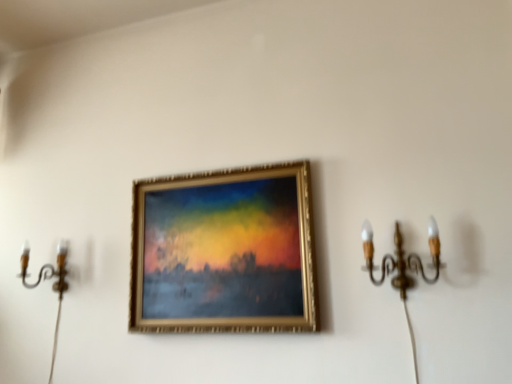
Identify the location of gold metallic chandelier at right, the second candle holder positioned from the back. (401, 258).

The height and width of the screenshot is (384, 512). What do you see at coordinates (47, 269) in the screenshot?
I see `gold metallic candle holder at left, acting as the first candle holder starting from the back` at bounding box center [47, 269].

At what (x,y) coordinates should I click in order to perform the action: click on gold metallic chandelier at right, which is the first candle holder from front to back. Please return your answer as a coordinate pair (x, y). The width and height of the screenshot is (512, 384). Looking at the image, I should click on (401, 258).

Does gold metallic chandelier at right, which appears as the 1th candle holder when viewed from the right, come in front of gold metallic picture frame at center?

Yes, gold metallic chandelier at right, which appears as the 1th candle holder when viewed from the right, is closer to the camera.

Is gold metallic chandelier at right, which is the first candle holder from front to back, aimed at gold metallic picture frame at center?

No, gold metallic chandelier at right, which is the first candle holder from front to back, is not facing towards gold metallic picture frame at center.

Is gold metallic chandelier at right, which appears as the 1th candle holder when viewed from the right, with gold metallic picture frame at center?

No, gold metallic chandelier at right, which appears as the 1th candle holder when viewed from the right, is not in contact with gold metallic picture frame at center.

What's the angular difference between gold metallic candle holder at left, placed as the 2th candle holder when sorted from right to left, and gold metallic picture frame at center's facing directions?

0.162 degrees.

Does gold metallic candle holder at left, the 1th candle holder viewed from the left, turn towards gold metallic picture frame at center?

No, gold metallic candle holder at left, the 1th candle holder viewed from the left, does not turn towards gold metallic picture frame at center.

Consider the image. Considering the relative sizes of gold metallic candle holder at left, acting as the first candle holder starting from the back, and gold metallic picture frame at center in the image provided, is gold metallic candle holder at left, acting as the first candle holder starting from the back, wider than gold metallic picture frame at center?

Yes.

From the image's perspective, is gold metallic candle holder at left, acting as the first candle holder starting from the back, located above or below gold metallic picture frame at center?

Based on their image positions, gold metallic candle holder at left, acting as the first candle holder starting from the back, is located beneath gold metallic picture frame at center.

From a real-world perspective, who is located lower, gold metallic chandelier at right, which appears as the 1th candle holder when viewed from the right, or gold metallic candle holder at left, acting as the first candle holder starting from the back?

From a 3D spatial view, gold metallic chandelier at right, which appears as the 1th candle holder when viewed from the right, is below.

Can you confirm if gold metallic chandelier at right, the second candle holder positioned from the back, is shorter than gold metallic candle holder at left, positioned as the 2th candle holder in front-to-back order?

No.

Identify the location of candle holder to the left of gold metallic picture frame at center. This screenshot has height=384, width=512. (47, 269).

Does gold metallic picture frame at center have a lesser height compared to gold metallic candle holder at left, positioned as the 2th candle holder in front-to-back order?

Incorrect, the height of gold metallic picture frame at center does not fall short of that of gold metallic candle holder at left, positioned as the 2th candle holder in front-to-back order.

Between gold metallic picture frame at center and gold metallic candle holder at left, positioned as the 2th candle holder in front-to-back order, which one appears on the right side from the viewer's perspective?

gold metallic picture frame at center.

In terms of size, does gold metallic picture frame at center appear bigger or smaller than gold metallic candle holder at left, placed as the 2th candle holder when sorted from right to left?

Considering their sizes, gold metallic picture frame at center takes up more space than gold metallic candle holder at left, placed as the 2th candle holder when sorted from right to left.

Is gold metallic picture frame at center bigger than gold metallic chandelier at right, which appears as the 1th candle holder when viewed from the right?

Yes, gold metallic picture frame at center is bigger than gold metallic chandelier at right, which appears as the 1th candle holder when viewed from the right.

Is gold metallic picture frame at center wider or thinner than gold metallic chandelier at right, the second candle holder positioned from the back?

Considering their sizes, gold metallic picture frame at center looks slimmer than gold metallic chandelier at right, the second candle holder positioned from the back.

Between gold metallic picture frame at center and gold metallic chandelier at right, which is the first candle holder from front to back, which one appears on the right side from the viewer's perspective?

gold metallic chandelier at right, which is the first candle holder from front to back.

Can you confirm if gold metallic candle holder at left, acting as the first candle holder starting from the back, is thinner than gold metallic chandelier at right, which appears as the 1th candle holder when viewed from the right?

Indeed, gold metallic candle holder at left, acting as the first candle holder starting from the back, has a lesser width compared to gold metallic chandelier at right, which appears as the 1th candle holder when viewed from the right.

Identify the location of candle holder that appears in front of the gold metallic candle holder at left, positioned as the 2th candle holder in front-to-back order. (401, 258).

Considering the relative positions of gold metallic candle holder at left, placed as the 2th candle holder when sorted from right to left, and gold metallic chandelier at right, which appears as the 1th candle holder when viewed from the right, in the image provided, is gold metallic candle holder at left, placed as the 2th candle holder when sorted from right to left, to the left of gold metallic chandelier at right, which appears as the 1th candle holder when viewed from the right, from the viewer's perspective?

Yes.

From the image's perspective, which is below, gold metallic candle holder at left, the 1th candle holder viewed from the left, or gold metallic chandelier at right, which is the first candle holder from front to back?

gold metallic candle holder at left, the 1th candle holder viewed from the left.

Where is `picture frame on the left side of gold metallic chandelier at right, which is the first candle holder from front to back`? picture frame on the left side of gold metallic chandelier at right, which is the first candle holder from front to back is located at coordinates pyautogui.click(x=224, y=252).

Identify the location of picture frame above the gold metallic candle holder at left, acting as the first candle holder starting from the back (from the image's perspective). (224, 252).

When comparing their distances from gold metallic candle holder at left, acting as the first candle holder starting from the back, does gold metallic picture frame at center or gold metallic chandelier at right, which is the second candle holder from left to right, seem further?

gold metallic chandelier at right, which is the second candle holder from left to right, is further to gold metallic candle holder at left, acting as the first candle holder starting from the back.

Looking at the image, which one is located further to gold metallic chandelier at right, which is the first candle holder from front to back, gold metallic candle holder at left, acting as the first candle holder starting from the back, or gold metallic picture frame at center?

Based on the image, gold metallic candle holder at left, acting as the first candle holder starting from the back, appears to be further to gold metallic chandelier at right, which is the first candle holder from front to back.

In the scene shown: From the image, which object appears to be nearer to gold metallic candle holder at left, the 1th candle holder viewed from the left, gold metallic chandelier at right, the second candle holder positioned from the back, or gold metallic picture frame at center?

Based on the image, gold metallic picture frame at center appears to be nearer to gold metallic candle holder at left, the 1th candle holder viewed from the left.

Looking at the image, which one is located further to gold metallic picture frame at center, gold metallic chandelier at right, which is the second candle holder from left to right, or gold metallic candle holder at left, positioned as the 2th candle holder in front-to-back order?

gold metallic candle holder at left, positioned as the 2th candle holder in front-to-back order, is further to gold metallic picture frame at center.

From the image, which object appears to be farther from gold metallic picture frame at center, gold metallic candle holder at left, the 1th candle holder viewed from the left, or gold metallic chandelier at right, which appears as the 1th candle holder when viewed from the right?

gold metallic candle holder at left, the 1th candle holder viewed from the left, is further to gold metallic picture frame at center.

From the image, which object appears to be farther from gold metallic chandelier at right, which is the first candle holder from front to back, gold metallic picture frame at center or gold metallic candle holder at left, acting as the first candle holder starting from the back?

gold metallic candle holder at left, acting as the first candle holder starting from the back.

Where is `picture frame between gold metallic candle holder at left, positioned as the 2th candle holder in front-to-back order, and gold metallic chandelier at right, the second candle holder positioned from the back, from left to right`? picture frame between gold metallic candle holder at left, positioned as the 2th candle holder in front-to-back order, and gold metallic chandelier at right, the second candle holder positioned from the back, from left to right is located at coordinates (224, 252).